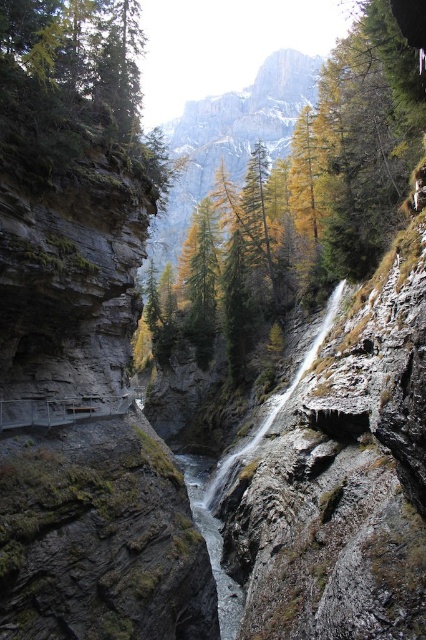
Does golden larch trees at upper center have a greater width compared to clear water at center?

Indeed, golden larch trees at upper center has a greater width compared to clear water at center.

Is point (178, 246) behind point (233, 621)?

Yes.

Describe the element at coordinates (230, 138) in the screenshot. I see `golden larch trees at upper center` at that location.

Where is `golden larch trees at upper center`? Image resolution: width=426 pixels, height=640 pixels. golden larch trees at upper center is located at coordinates (230, 138).